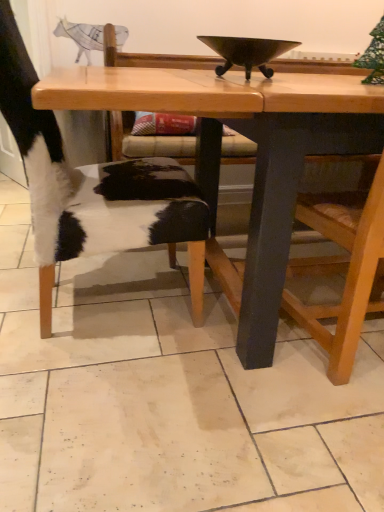
Describe the element at coordinates (343, 269) in the screenshot. I see `wooden chair at right` at that location.

In order to click on wooden table at center in this screenshot , I will do `click(256, 160)`.

Where is `cowhide leather chair at left`? The image size is (384, 512). cowhide leather chair at left is located at coordinates (92, 188).

From the image's perspective, is wooden table at center positioned above or below shiny dark metal bowl at center?

wooden table at center is below shiny dark metal bowl at center.

Is wooden table at center wider or thinner than shiny dark metal bowl at center?

Clearly, wooden table at center has more width compared to shiny dark metal bowl at center.

This screenshot has width=384, height=512. I want to click on table on the right of the shiny dark metal bowl at center, so click(256, 160).

Considering the points (317, 112) and (250, 64), which point is in front, point (317, 112) or point (250, 64)?

The point (317, 112) is closer to the camera.

Is wooden chair at right taller or shorter than cowhide leather chair at left?

Considering their sizes, wooden chair at right has less height than cowhide leather chair at left.

From the image's perspective, between wooden chair at right and cowhide leather chair at left, who is located below?

wooden chair at right is shown below in the image.

In the image, there is a wooden chair at right. Where is `chair above it (from the image's perspective)`? Image resolution: width=384 pixels, height=512 pixels. chair above it (from the image's perspective) is located at coordinates (92, 188).

Looking at this image, can you confirm if wooden chair at right is bigger than cowhide leather chair at left?

No, wooden chair at right is not bigger than cowhide leather chair at left.

Is point (285, 179) farther from camera compared to point (305, 214)?

No, (285, 179) is in front of (305, 214).

In the image, is wooden table at center positioned in front of or behind wooden chair at right?

Visually, wooden table at center is located behind wooden chair at right.

Is wooden table at center completely or partially outside of wooden chair at right?

Absolutely, wooden table at center is external to wooden chair at right.

Looking at this image, is wooden table at center turned away from wooden chair at right?

Yes.

Between wooden chair at right and shiny dark metal bowl at center, which one has smaller width?

shiny dark metal bowl at center.

How many degrees apart are the facing directions of wooden chair at right and shiny dark metal bowl at center?

The angle between the facing direction of wooden chair at right and the facing direction of shiny dark metal bowl at center is 175 degrees.

Could you tell me if wooden chair at right is facing shiny dark metal bowl at center?

No, wooden chair at right is not aimed at shiny dark metal bowl at center.

Which is closer to the camera, (262, 59) or (188, 201)?

The point (262, 59) is closer to the camera.

This screenshot has height=512, width=384. Identify the location of chair in front of the shiny dark metal bowl at center. (92, 188).

Considering the positions of objects shiny dark metal bowl at center and cowhide leather chair at left in the image provided, who is behind, shiny dark metal bowl at center or cowhide leather chair at left?

Positioned behind is shiny dark metal bowl at center.

From the image's perspective, is shiny dark metal bowl at center below wooden chair at right?

Incorrect, from the image's perspective, shiny dark metal bowl at center is higher than wooden chair at right.

Would you consider shiny dark metal bowl at center to be distant from wooden chair at right?

That's not correct — shiny dark metal bowl at center is a little close to wooden chair at right.

Which object is thinner, shiny dark metal bowl at center or wooden chair at right?

shiny dark metal bowl at center.

Which of these two, shiny dark metal bowl at center or wooden chair at right, stands taller?

Standing taller between the two is wooden chair at right.

Is cowhide leather chair at left not near shiny dark metal bowl at center?

cowhide leather chair at left is actually quite close to shiny dark metal bowl at center.

Is cowhide leather chair at left taller or shorter than shiny dark metal bowl at center?

A: cowhide leather chair at left is taller than shiny dark metal bowl at center.

Is cowhide leather chair at left not within shiny dark metal bowl at center?

cowhide leather chair at left lies outside shiny dark metal bowl at center's area.

Considering the relative sizes of cowhide leather chair at left and shiny dark metal bowl at center in the image provided, is cowhide leather chair at left thinner than shiny dark metal bowl at center?

No.

Image resolution: width=384 pixels, height=512 pixels. I want to click on bowl on the left of wooden table at center, so [x=247, y=52].

You are a GUI agent. You are given a task and a screenshot of the screen. Output one action in this format:
    pyautogui.click(x=<x>, y=<y>)
    Task: Click on the armchair that appears in front of the cowhide leather chair at left
    Image resolution: width=384 pixels, height=512 pixels.
    Given the screenshot: What is the action you would take?
    pyautogui.click(x=343, y=269)

When comparing their distances from wooden table at center, does wooden chair at right or cowhide leather chair at left seem closer?

wooden chair at right is closer to wooden table at center.

Considering their positions, is shiny dark metal bowl at center positioned further to wooden table at center than wooden chair at right?

shiny dark metal bowl at center is positioned further to the anchor wooden table at center.

When comparing their distances from cowhide leather chair at left, does wooden chair at right or shiny dark metal bowl at center seem further?

wooden chair at right.

Looking at the image, which one is located further to cowhide leather chair at left, wooden table at center or wooden chair at right?

wooden chair at right is further to cowhide leather chair at left.

From the image, which object appears to be farther from cowhide leather chair at left, shiny dark metal bowl at center or wooden table at center?

Among the two, shiny dark metal bowl at center is located further to cowhide leather chair at left.

Looking at the image, which one is located further to wooden chair at right, shiny dark metal bowl at center or wooden table at center?

The object further to wooden chair at right is shiny dark metal bowl at center.

Consider the image. Estimate the real-world distances between objects in this image. Which object is further from wooden chair at right, shiny dark metal bowl at center or cowhide leather chair at left?

shiny dark metal bowl at center is positioned further to the anchor wooden chair at right.

From the image, which object appears to be nearer to cowhide leather chair at left, shiny dark metal bowl at center or wooden chair at right?

shiny dark metal bowl at center is closer to cowhide leather chair at left.

Image resolution: width=384 pixels, height=512 pixels. Identify the location of table between shiny dark metal bowl at center and wooden chair at right vertically. (256, 160).

Identify the location of table between cowhide leather chair at left and wooden chair at right in the horizontal direction. (256, 160).

Locate an element on the screen. This screenshot has height=512, width=384. bowl situated between cowhide leather chair at left and wooden chair at right from left to right is located at coordinates (247, 52).

Locate an element on the screen. This screenshot has width=384, height=512. bowl between cowhide leather chair at left and wooden table at center is located at coordinates (247, 52).